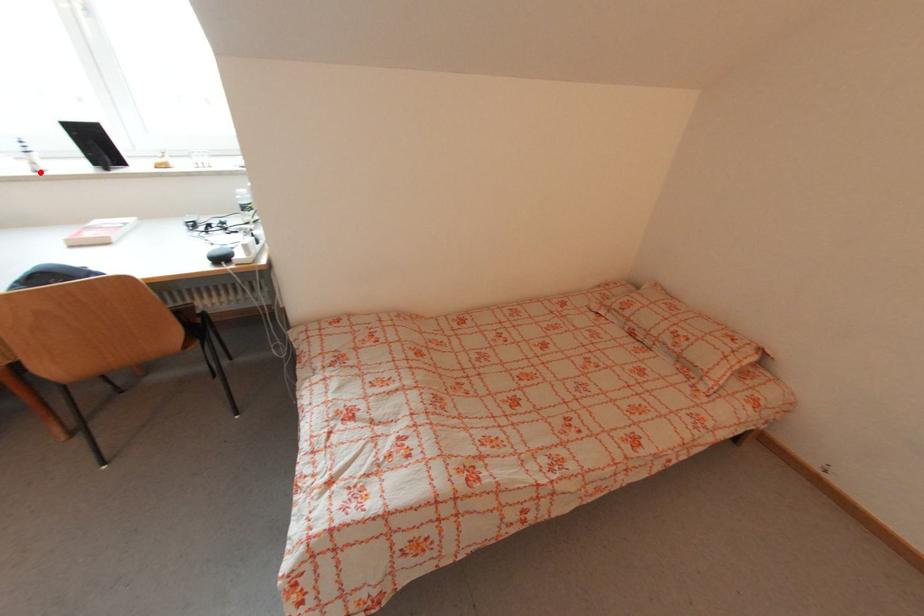
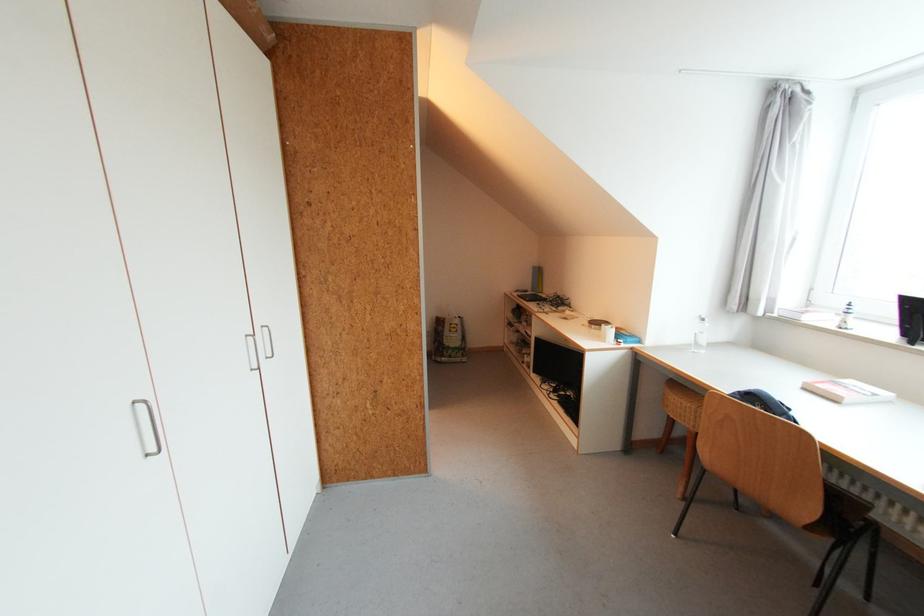
Question: I am providing you with two images of the same scene from different viewpoints. Image1 has a red point marked. In image2, the corresponding 3D location appears at what relative position? Reply with the corresponding letter.

Choices:
 (A) Closer
 (B) Farther

Answer: (A)